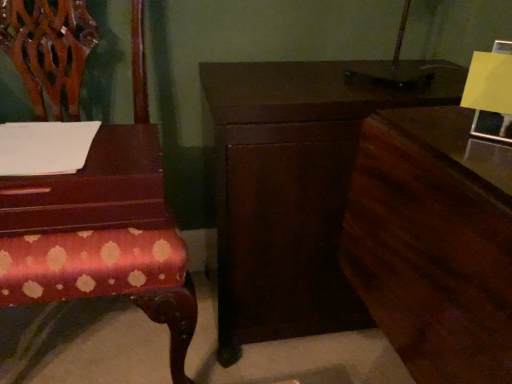
I want to click on free region under polished wood chair at left (from a real-world perspective), so click(91, 341).